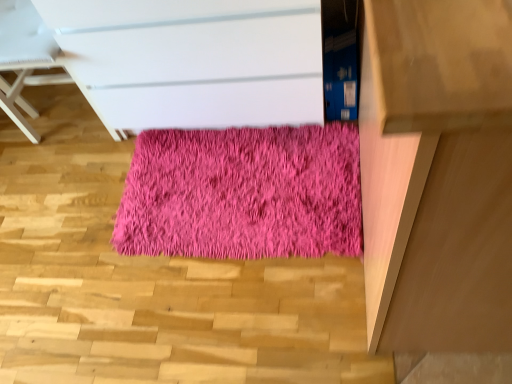
Question: Is pink fluffy rug at center to the left of light brown wooden table at right from the viewer's perspective?

Choices:
 (A) yes
 (B) no

Answer: (A)

Question: From the image's perspective, would you say pink fluffy rug at center is positioned over light brown wooden table at right?

Choices:
 (A) yes
 (B) no

Answer: (B)

Question: Can you confirm if pink fluffy rug at center is thinner than light brown wooden table at right?

Choices:
 (A) no
 (B) yes

Answer: (B)

Question: Can you confirm if pink fluffy rug at center is positioned to the right of light brown wooden table at right?

Choices:
 (A) yes
 (B) no

Answer: (B)

Question: From the image's perspective, does pink fluffy rug at center appear lower than light brown wooden table at right?

Choices:
 (A) no
 (B) yes

Answer: (B)

Question: Considering the relative positions of light brown wooden table at right and matte white chest of drawers at center in the image provided, is light brown wooden table at right to the left or to the right of matte white chest of drawers at center?

Choices:
 (A) right
 (B) left

Answer: (A)

Question: From a real-world perspective, is light brown wooden table at right positioned above or below matte white chest of drawers at center?

Choices:
 (A) above
 (B) below

Answer: (A)

Question: Do you think light brown wooden table at right is within matte white chest of drawers at center, or outside of it?

Choices:
 (A) inside
 (B) outside

Answer: (B)

Question: From the image's perspective, relative to matte white chest of drawers at center, is light brown wooden table at right above or below?

Choices:
 (A) below
 (B) above

Answer: (A)

Question: Considering the positions of pink fluffy rug at center and light brown wooden table at right in the image, is pink fluffy rug at center taller or shorter than light brown wooden table at right?

Choices:
 (A) tall
 (B) short

Answer: (B)

Question: From a real-world perspective, is pink fluffy rug at center above or below light brown wooden table at right?

Choices:
 (A) above
 (B) below

Answer: (A)

Question: Is pink fluffy rug at center in front of or behind light brown wooden table at right in the image?

Choices:
 (A) behind
 (B) front

Answer: (B)

Question: Based on their sizes in the image, would you say pink fluffy rug at center is bigger or smaller than light brown wooden table at right?

Choices:
 (A) small
 (B) big

Answer: (B)

Question: Considering the positions of point (246, 208) and point (407, 314), is point (246, 208) closer or farther from the camera than point (407, 314)?

Choices:
 (A) closer
 (B) farther

Answer: (B)

Question: Is shaggy pink rug at center to the left or to the right of light brown wooden table at right in the image?

Choices:
 (A) right
 (B) left

Answer: (B)